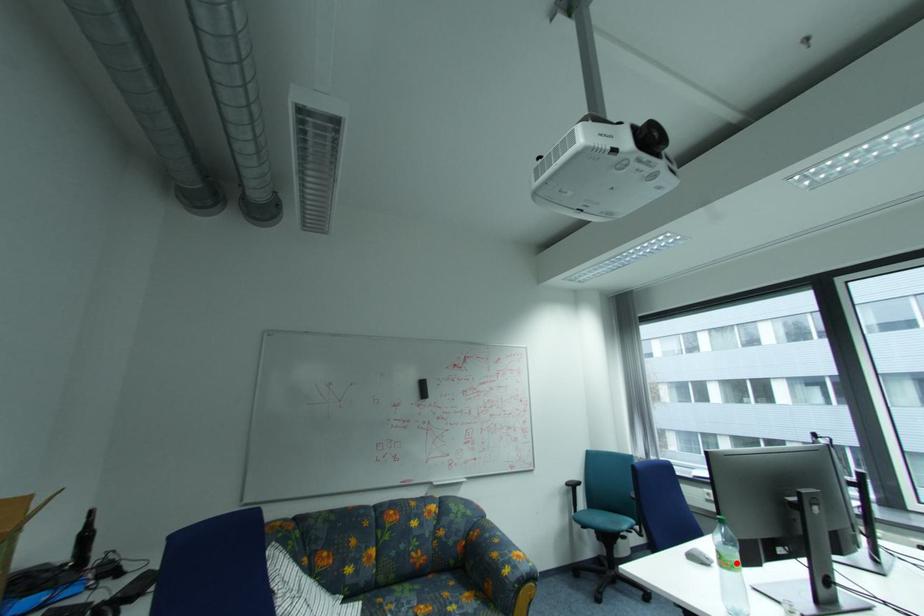
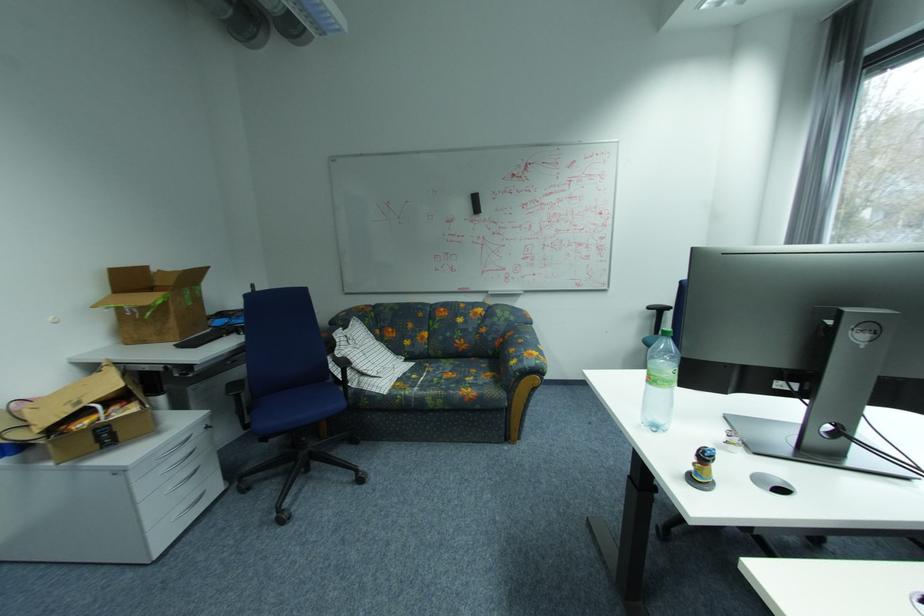
Question: I am providing you with two images of the same scene from different viewpoints. Image1 has a red point marked. In image2, the corresponding 3D location appears at what relative position? Reply with the corresponding letter.

Choices:
 (A) Closer
 (B) Farther

Answer: (B)